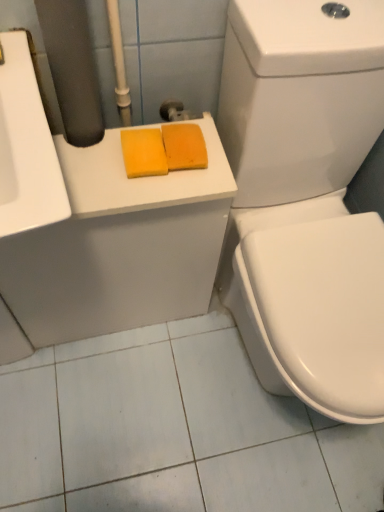
You are a GUI agent. You are given a task and a screenshot of the screen. Output one action in this format:
    pyautogui.click(x=<x>, y=<y>)
    Task: Click on the free spot in front of yellow sponge at center, which is the first soap in left-to-right order
    
    Given the screenshot: What is the action you would take?
    pyautogui.click(x=130, y=192)